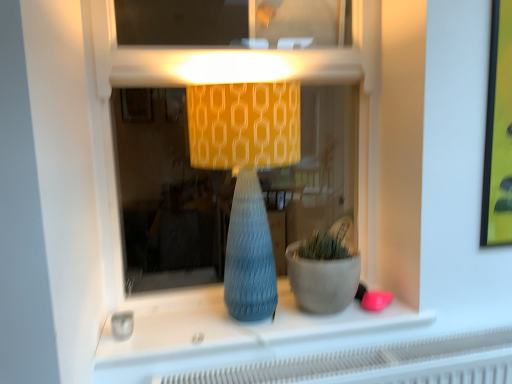
Question: From a real-world perspective, is matte gray vase at center physically below matte blue vase at center?

Choices:
 (A) no
 (B) yes

Answer: (B)

Question: Is matte gray vase at center wider than matte blue vase at center?

Choices:
 (A) yes
 (B) no

Answer: (B)

Question: Is matte gray vase at center directly adjacent to matte blue vase at center?

Choices:
 (A) no
 (B) yes

Answer: (A)

Question: From the image's perspective, is matte gray vase at center over matte blue vase at center?

Choices:
 (A) yes
 (B) no

Answer: (B)

Question: Would you consider matte gray vase at center to be distant from matte blue vase at center?

Choices:
 (A) yes
 (B) no

Answer: (B)

Question: Based on their positions, is matte concrete flowerpot at center located to the left or right of matte yellow fabric lampshade at center?

Choices:
 (A) left
 (B) right

Answer: (B)

Question: Considering the positions of matte concrete flowerpot at center and matte yellow fabric lampshade at center in the image, is matte concrete flowerpot at center wider or thinner than matte yellow fabric lampshade at center?

Choices:
 (A) wide
 (B) thin

Answer: (B)

Question: Is point (305, 268) closer or farther from the camera than point (284, 82)?

Choices:
 (A) closer
 (B) farther

Answer: (B)

Question: In terms of height, does matte concrete flowerpot at center look taller or shorter compared to matte yellow fabric lampshade at center?

Choices:
 (A) tall
 (B) short

Answer: (B)

Question: In terms of size, does matte gray vase at center appear bigger or smaller than matte yellow fabric lampshade at center?

Choices:
 (A) small
 (B) big

Answer: (A)

Question: From the image's perspective, relative to matte yellow fabric lampshade at center, is matte gray vase at center above or below?

Choices:
 (A) above
 (B) below

Answer: (B)

Question: Looking at their shapes, would you say matte gray vase at center is wider or thinner than matte yellow fabric lampshade at center?

Choices:
 (A) wide
 (B) thin

Answer: (B)

Question: Is point (218, 339) closer or farther from the camera than point (241, 291)?

Choices:
 (A) farther
 (B) closer

Answer: (B)

Question: Based on their sizes in the image, would you say matte concrete flowerpot at center is bigger or smaller than matte gray vase at center?

Choices:
 (A) small
 (B) big

Answer: (B)

Question: Visually, is matte concrete flowerpot at center positioned to the left or to the right of matte gray vase at center?

Choices:
 (A) right
 (B) left

Answer: (A)